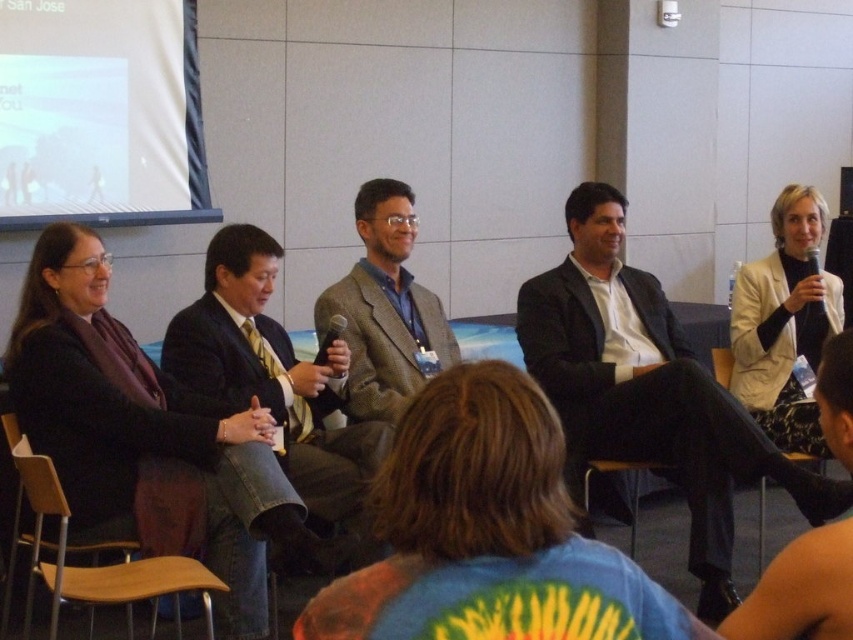
Question: Which object is closer to the camera taking this photo?

Choices:
 (A) matte black suit at right
 (B) wooden chair at lower left
 (C) white matte projection screen at upper left
 (D) textured brown blazer at center

Answer: (B)

Question: Which of the following is the farthest from the observer?

Choices:
 (A) (45, 72)
 (B) (374, 195)
 (C) (728, 378)
 (D) (207, 577)

Answer: (A)

Question: From the image, what is the correct spatial relationship of textured brown blazer at center in relation to wooden at right?

Choices:
 (A) left
 (B) right

Answer: (A)

Question: Is white matte projection screen at upper left further to camera compared to textured brown blazer at center?

Choices:
 (A) no
 (B) yes

Answer: (B)

Question: Estimate the real-world distances between objects in this image. Which object is closer to the wooden chair at lower left?

Choices:
 (A) wooden at right
 (B) white matte projection screen at upper left
 (C) textured brown blazer at center

Answer: (C)

Question: Observing the image, what is the correct spatial positioning of white matte projection screen at upper left in reference to wooden at right?

Choices:
 (A) left
 (B) right

Answer: (A)